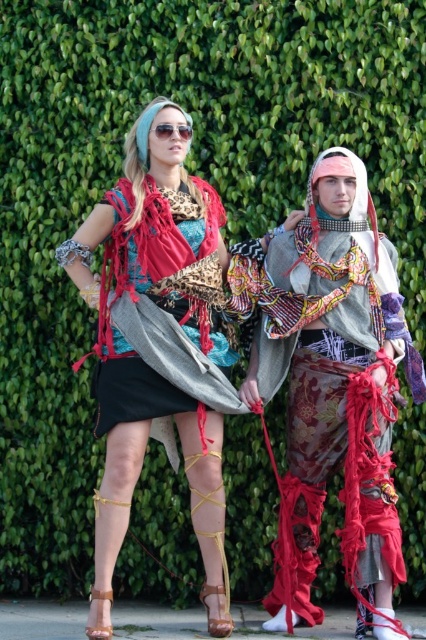
Question: Among these objects, which one is nearest to the camera?

Choices:
 (A) textured fabric pants at center
 (B) leopard print scarf at center
 (C) sunglasses at upper center

Answer: (B)

Question: Which point appears farthest from the camera in this image?

Choices:
 (A) (348, 256)
 (B) (129, 240)

Answer: (A)

Question: Does leopard print scarf at center have a smaller size compared to sunglasses at upper center?

Choices:
 (A) no
 (B) yes

Answer: (A)

Question: Is leopard print scarf at center thinner than leather/textured skirt at center?

Choices:
 (A) yes
 (B) no

Answer: (B)

Question: Which of the following is the farthest from the observer?

Choices:
 (A) sunglasses at upper center
 (B) leather/textured skirt at center

Answer: (A)

Question: Where is textured fabric pants at center located in relation to leather/textured skirt at center in the image?

Choices:
 (A) above
 (B) below

Answer: (B)